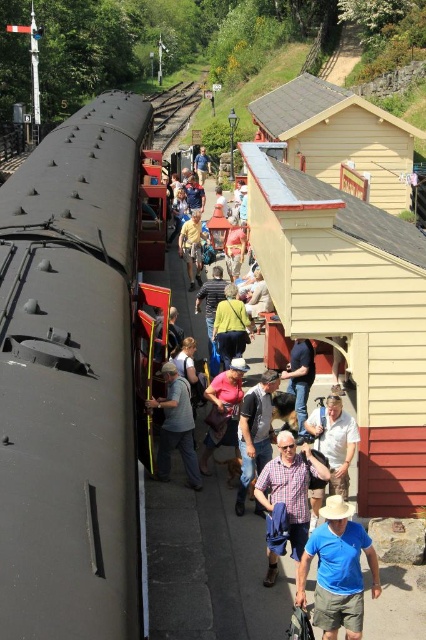
You are a photographer standing on the platform at the railway station. You want to take a photo of the blue cotton shirt at center and the light brown leather jacket at center. Which clothing item is wider in the image?

The blue cotton shirt at center is wider than the light brown leather jacket at center according to the description.

In the scene shown: You are a photographer standing on the platform at the railway station. You want to take a photo of the matte black train at center and the blue cotton shirt at center in the same frame. Can you fit both objects in your camera viewfinder without zooming in? Explain why.

The matte black train at center is wider than the blue cotton shirt at center. Since the train is larger in width, it might occupy more space in the frame, but both can still be included in the photo if positioned appropriately. However, without zooming, the exact fit depends on their distance from the camera and the camera lens used.